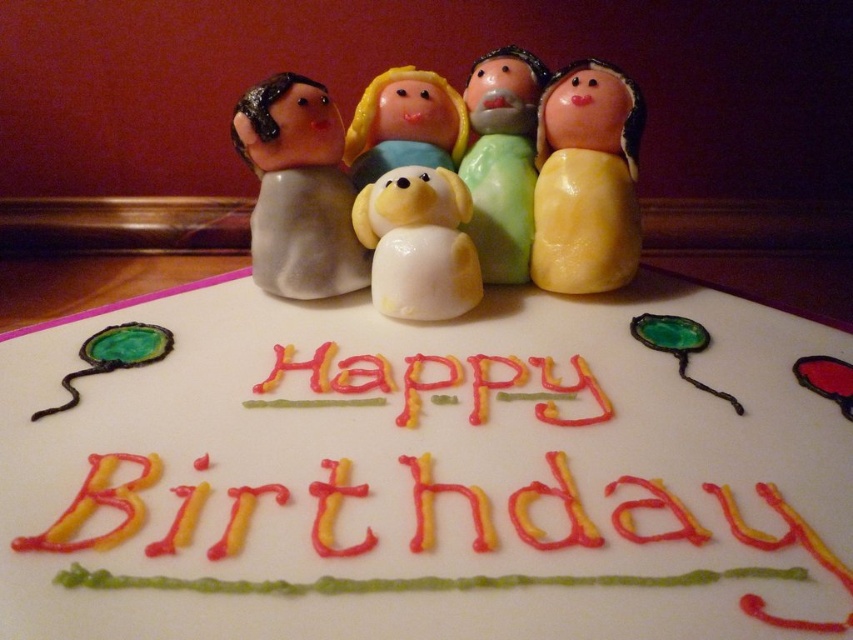
Who is more forward, (161, 604) or (286, 104)?

Point (161, 604) is more forward.

Can you confirm if white fondant cake at center is positioned to the left of matte gray figurine at left?

No, white fondant cake at center is not to the left of matte gray figurine at left.

Who is more forward, (686, 289) or (311, 214)?

Positioned in front is point (311, 214).

The image size is (853, 640). Identify the location of white fondant cake at center. (426, 468).

Is matte gray figurine at left positioned behind white glossy dog at center?

Yes.

This screenshot has height=640, width=853. What do you see at coordinates (299, 189) in the screenshot?
I see `matte gray figurine at left` at bounding box center [299, 189].

Is point (318, 109) behind point (453, 198)?

Yes, it is behind point (453, 198).

Image resolution: width=853 pixels, height=640 pixels. What are the coordinates of `matte gray figurine at left` in the screenshot? It's located at (299, 189).

Is white fondant cake at center thinner than yellow icing at center?

No, white fondant cake at center is not thinner than yellow icing at center.

Where is `white fondant cake at center`? The height and width of the screenshot is (640, 853). white fondant cake at center is located at coordinates (426, 468).

At what (x,y) coordinates should I click in order to perform the action: click on white fondant cake at center. Please return your answer as a coordinate pair (x, y). The width and height of the screenshot is (853, 640). Looking at the image, I should click on (426, 468).